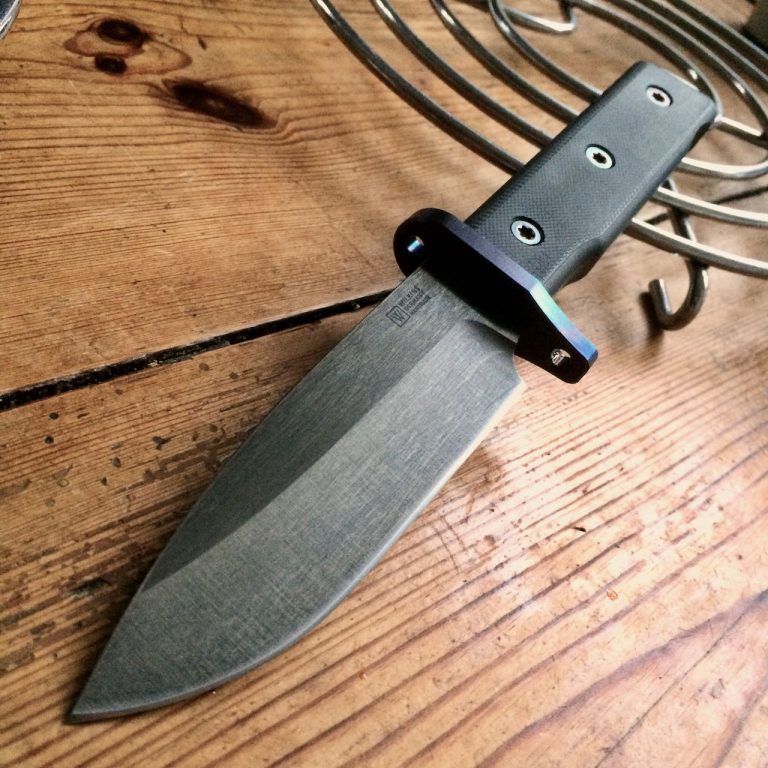
In order to click on black knife handle in this screenshot , I will do `click(588, 190)`.